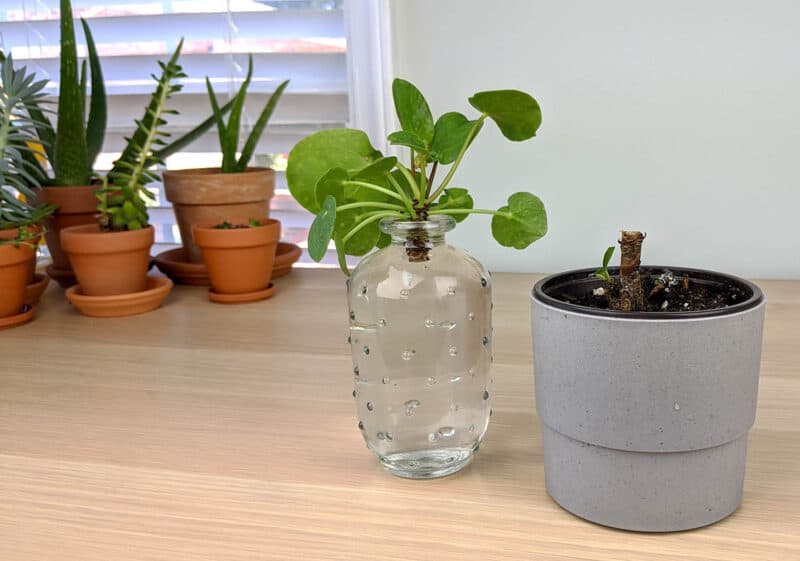
The image size is (800, 561). Identify the location of white trim around window. (385, 58).